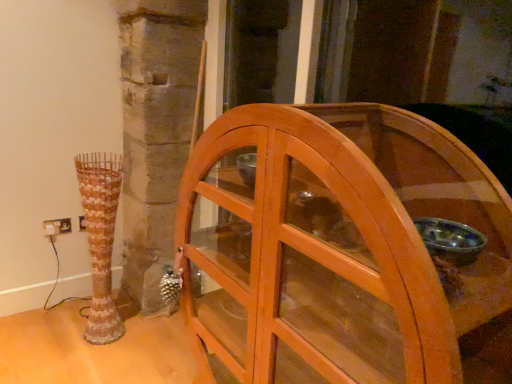
Where is `vacant area that is in front of rustic ceramic vase at left`? This screenshot has width=512, height=384. vacant area that is in front of rustic ceramic vase at left is located at coordinates (91, 362).